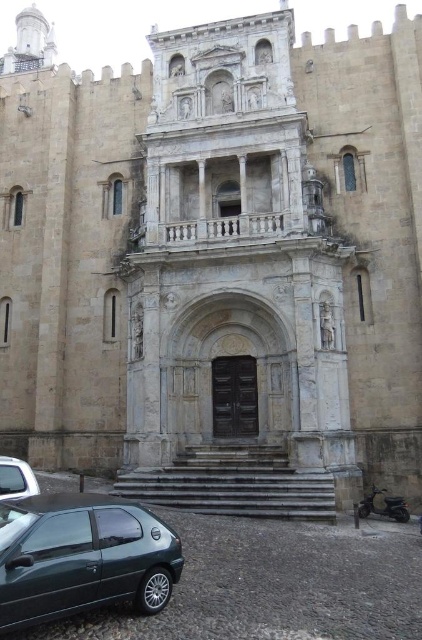
You are standing at the base of the steps leading to the historic stone building. A tour guide points out a specific point on the building facade, located at coordinates point (75, 600). If you want to take a photo of this point from where you are standing, how far will the camera need to focus?

The camera needs to focus at 25.92 meters because the point (75, 600) is 25.92 meters away from the camera.

You are a pedestrian standing in front of the historic stone building and see the metallic green hatchback at lower left and the silver metallic car at lower left. Which car is closer to the center of the building?

Result: The metallic green hatchback at lower left is closer to the center of the building because it is positioned on the right side of the silver metallic car at lower left, implying it is nearer to the central entrance.